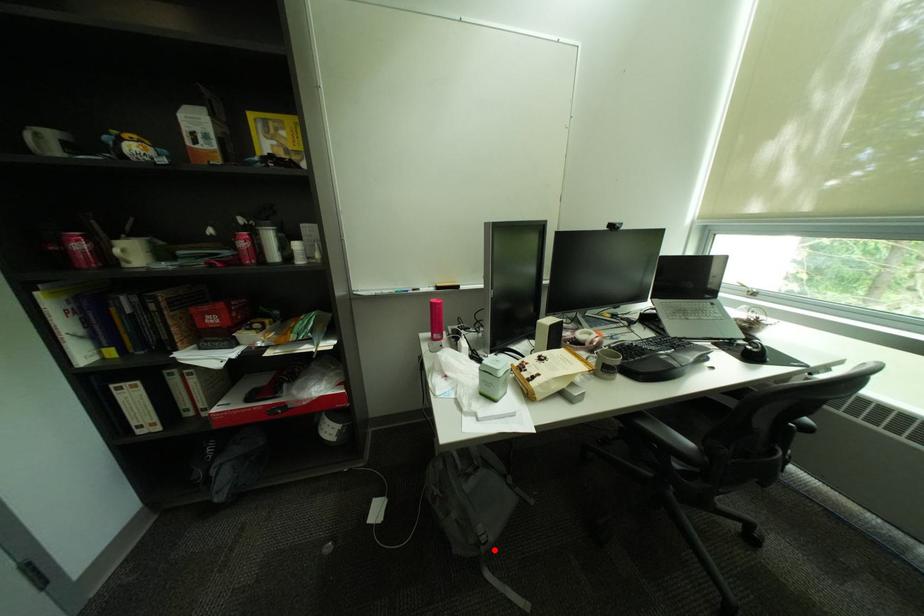
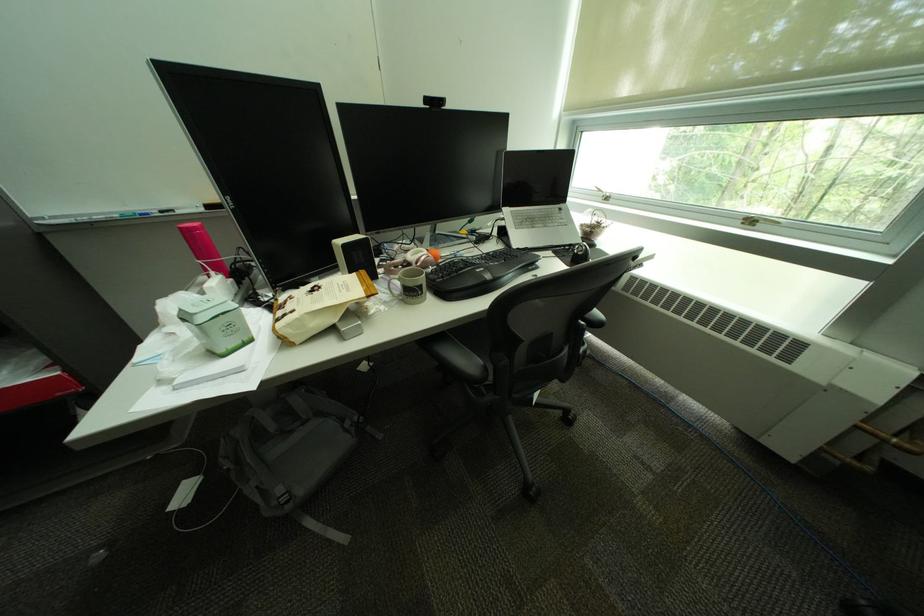
Question: A red point is marked in image1. In image2, is the corresponding 3D point closer to the camera or farther? Reply with the corresponding letter.

Choices:
 (A) The corresponding 3D point is closer.
 (B) The corresponding 3D point is farther.

Answer: (A)